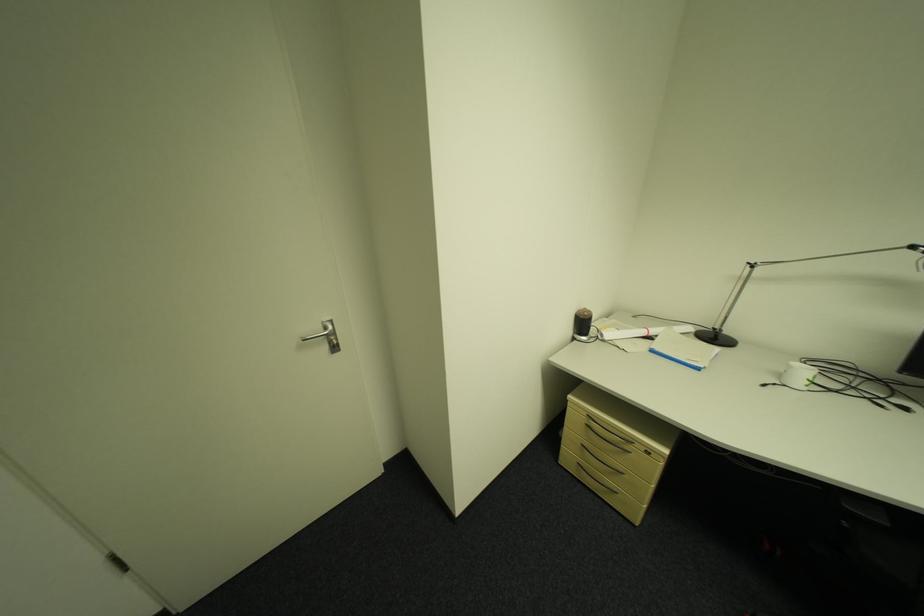
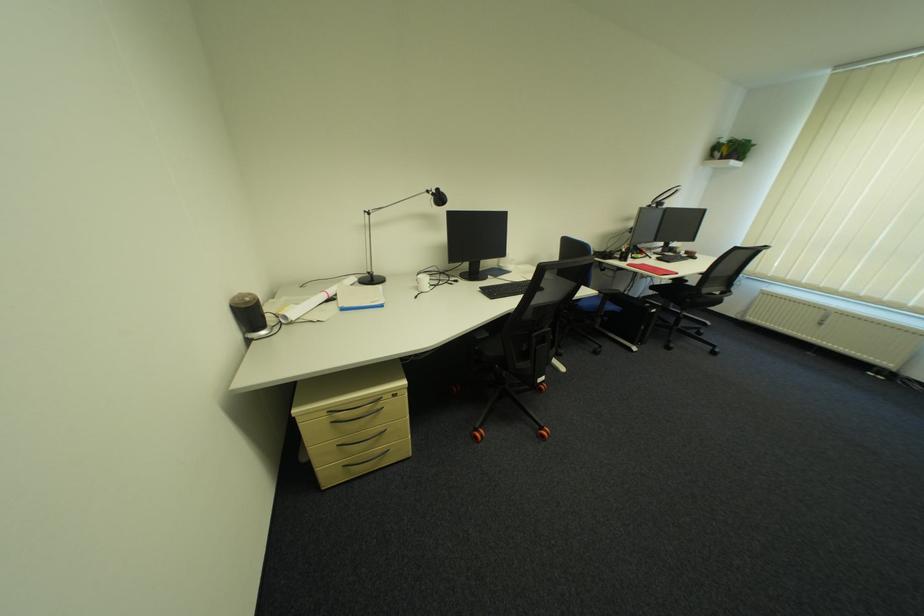
In the second image, find the point that corresponds to (789,376) in the first image.

(427, 288)